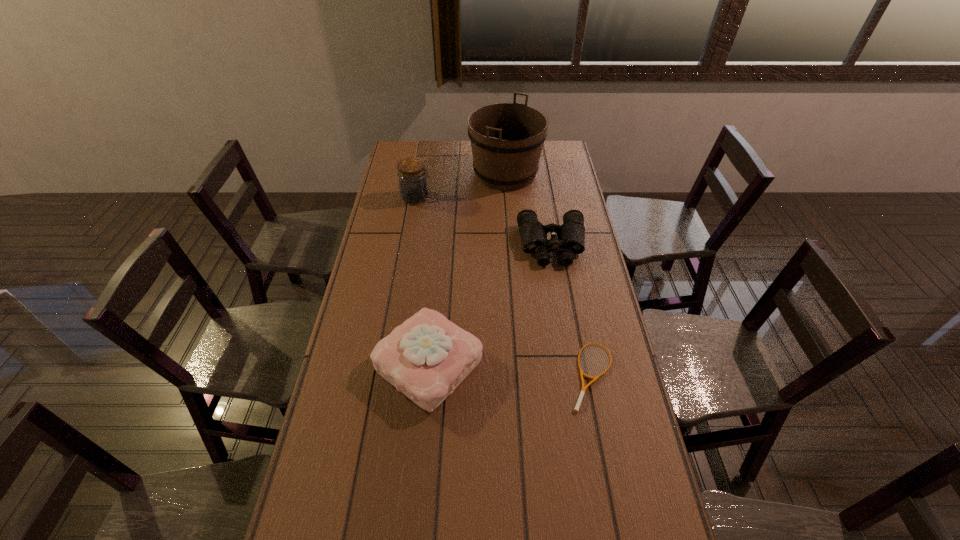
The width and height of the screenshot is (960, 540). Find the location of `vacant space at the far left corner of the desktop`. vacant space at the far left corner of the desktop is located at coordinates (410, 157).

Find the location of a particular element. This screenshot has width=960, height=540. free space at the far right corner is located at coordinates (542, 157).

This screenshot has width=960, height=540. Find the location of `vacant space that is in between the fourth shortest object and the tallest object`. vacant space that is in between the fourth shortest object and the tallest object is located at coordinates (461, 186).

Identify the location of free space between the tallest object and the jar. (461, 186).

This screenshot has height=540, width=960. I want to click on free space between the third tallest object and the jar, so click(x=422, y=281).

Locate an element on the screen. The width and height of the screenshot is (960, 540). blank region between the shortest object and the bucket is located at coordinates (549, 274).

Identify the location of free space between the third shortest object and the tallest object. (467, 269).

The image size is (960, 540). What are the coordinates of `object that is the closest one to the tennis racket` in the screenshot? It's located at (426, 357).

Select which object is the closest to the third tallest object. Please provide its 2D coordinates. Your answer should be formatted as a tuple, i.e. [(x, y)], where the tuple contains the x and y coordinates of a point satisfying the conditions above.

[(576, 409)]

Locate an element on the screen. vacant space that satisfies the following two spatial constraints: 1. on the lid of the tennis racket; 2. on the left side of the jar is located at coordinates (386, 375).